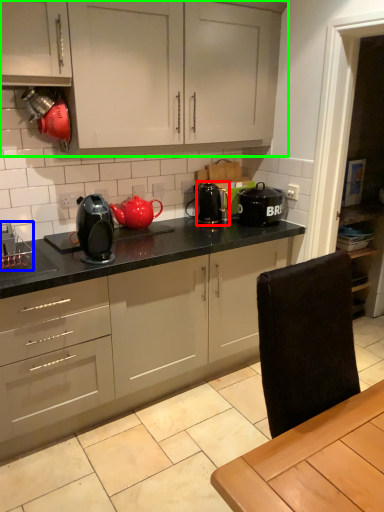
Question: Which is farther away from appliance (highlighted by a red box)? appliance (highlighted by a blue box) or cabinetry (highlighted by a green box)?

Choices:
 (A) appliance
 (B) cabinetry

Answer: (A)